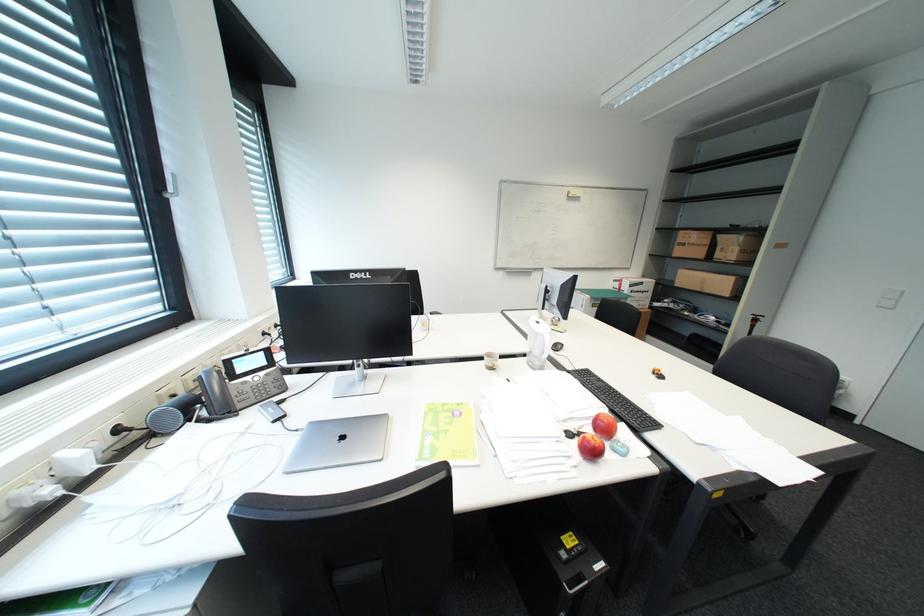
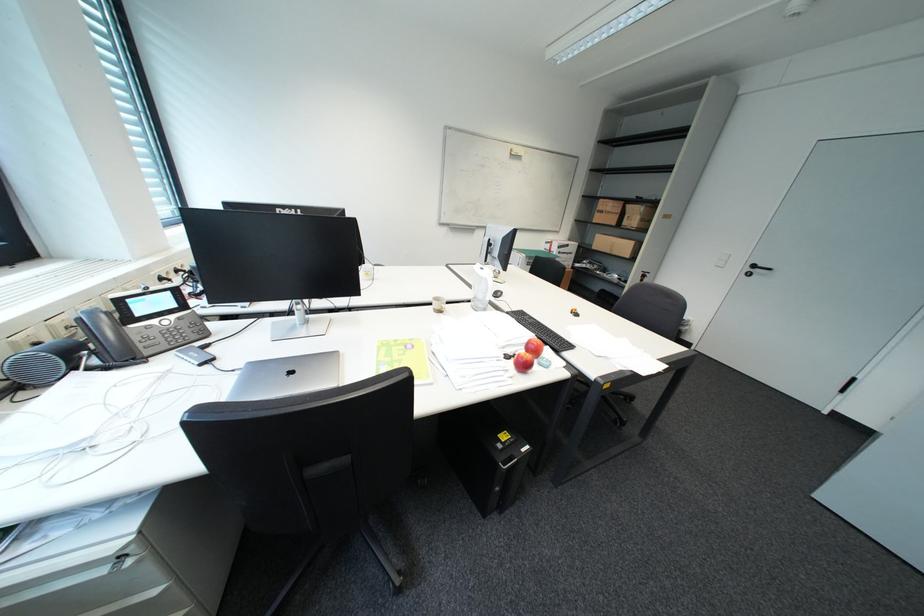
Consider the image. The images are taken continuously from a first-person perspective. In which direction are you moving?

The movement direction of the cameraman is left, backward.